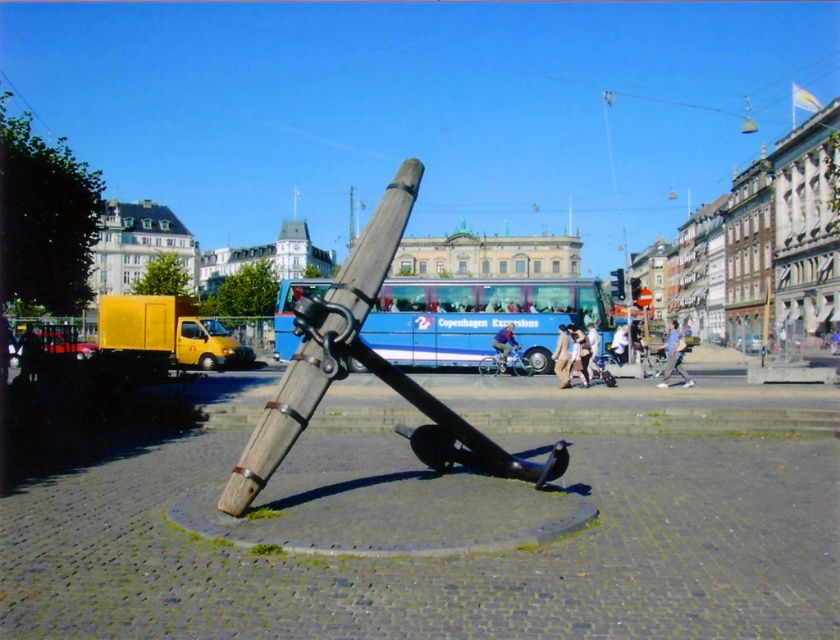
How much distance is there between wooden anchor at center and blue metallic bus at center?

They are 6.68 meters apart.

Is point (399, 387) closer to camera compared to point (516, 316)?

Yes, it is in front of point (516, 316).

Between point (555, 445) and point (486, 333), which one is positioned behind?

The point (486, 333) is behind.

The height and width of the screenshot is (640, 840). Identify the location of wooden anchor at center. click(366, 369).